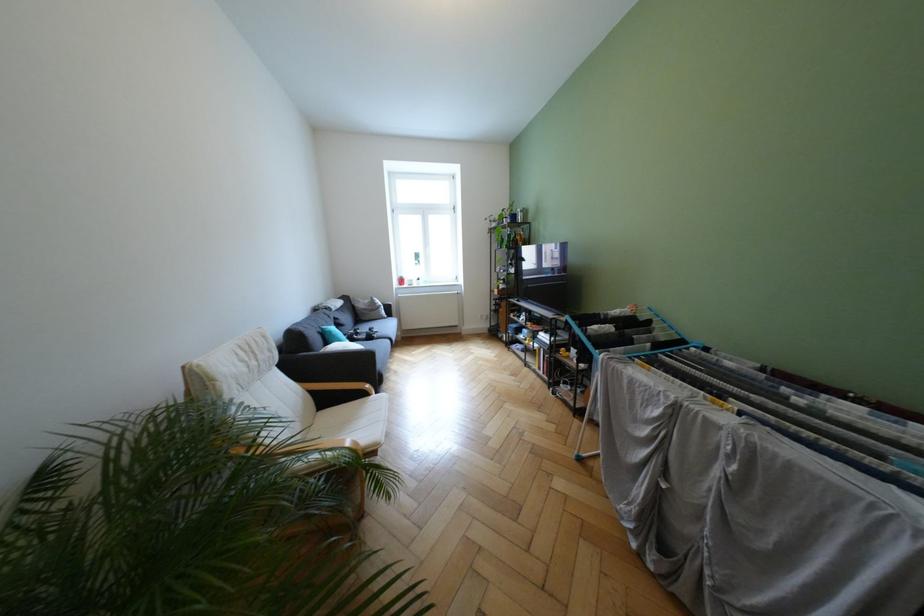
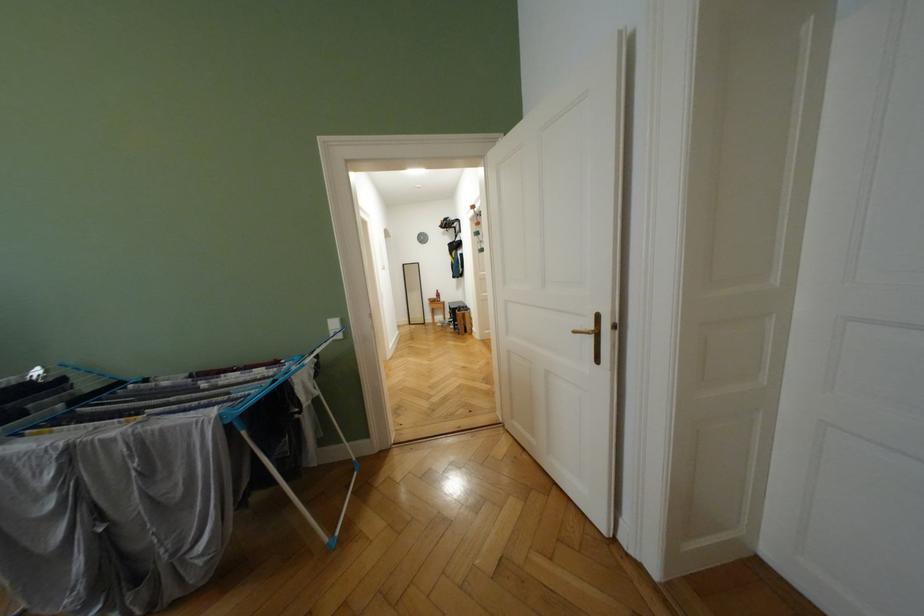
Question: How did the camera likely rotate?

Choices:
 (A) Left
 (B) Right
 (C) Up
 (D) Down

Answer: (B)